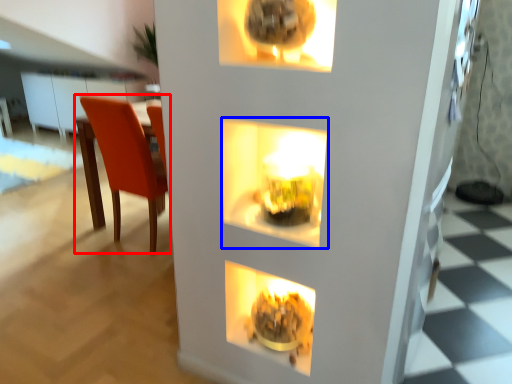
Question: Among these objects, which one is farthest to the camera, chair (highlighted by a red box) or shelf (highlighted by a blue box)?

Choices:
 (A) chair
 (B) shelf

Answer: (A)